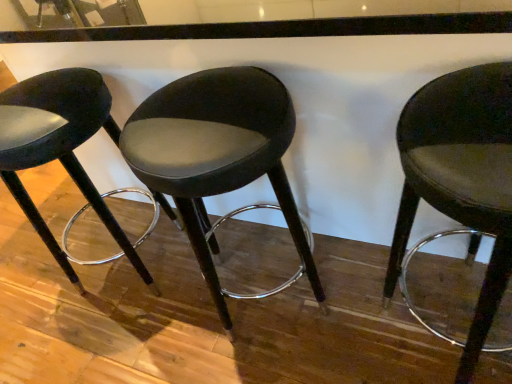
Question: Based on their positions, is suede-like black stool at center, arranged as the second chair when viewed from the left, located to the left or right of matte black stool at right, placed as the 1th chair when sorted from right to left?

Choices:
 (A) left
 (B) right

Answer: (A)

Question: Considering the positions of suede-like black stool at center, arranged as the second chair when viewed from the left, and matte black stool at right, which is the 3th chair from left to right, in the image, is suede-like black stool at center, arranged as the second chair when viewed from the left, bigger or smaller than matte black stool at right, which is the 3th chair from left to right,?

Choices:
 (A) small
 (B) big

Answer: (B)

Question: Which is farther from the suede-like black stool at center, arranged as the second chair when viewed from the left?

Choices:
 (A) satin black stool at left, acting as the 1th chair starting from the left
 (B) matte black stool at right, which is the 3th chair from left to right

Answer: (A)

Question: Estimate the real-world distances between objects in this image. Which object is closer to the satin black stool at left, acting as the 1th chair starting from the left?

Choices:
 (A) matte black stool at right, which is the 3th chair from left to right
 (B) suede-like black stool at center, arranged as the second chair when viewed from the left

Answer: (B)